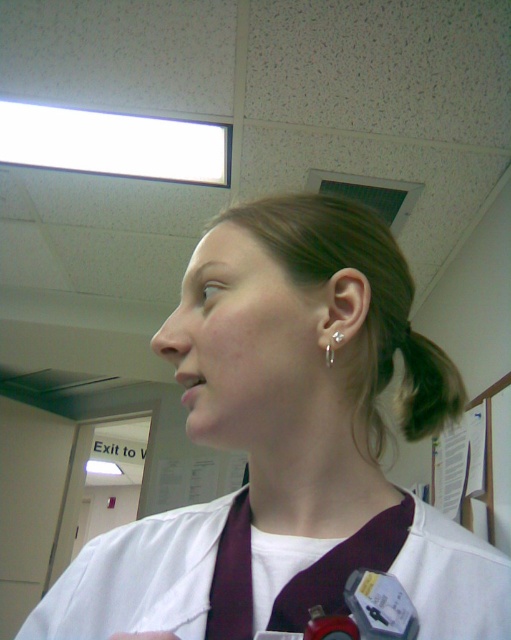
Question: Does white fabric at center have a lesser width compared to dark brown hair at upper right?

Choices:
 (A) yes
 (B) no

Answer: (B)

Question: From the image, what is the correct spatial relationship of dark brown hair at upper right in relation to white matte lab coat at center?

Choices:
 (A) below
 (B) above

Answer: (B)

Question: Which object is farther from the camera taking this photo?

Choices:
 (A) dark brown hair at upper right
 (B) white matte lab coat at center

Answer: (A)

Question: Which object appears farthest from the camera in this image?

Choices:
 (A) white fabric at center
 (B) white matte lab coat at center

Answer: (B)

Question: Is dark brown hair at upper right bigger than white matte lab coat at center?

Choices:
 (A) no
 (B) yes

Answer: (A)

Question: Which object is closer to the camera taking this photo?

Choices:
 (A) dark brown hair at upper right
 (B) white fabric at center
 (C) white matte lab coat at center

Answer: (B)